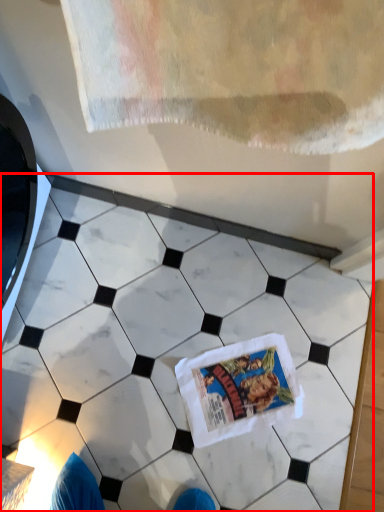
Question: From the image's perspective, what is the correct spatial relationship of marble (annotated by the red box) in relation to comic book?

Choices:
 (A) above
 (B) below

Answer: (A)